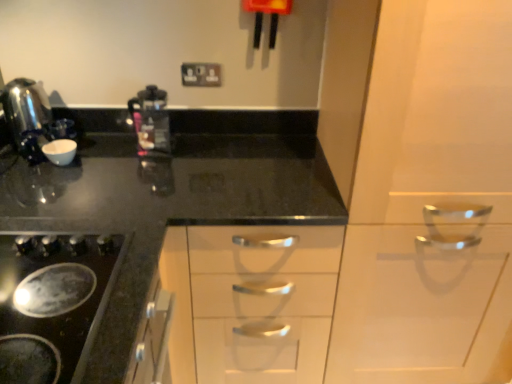
Question: Is polished stainless steel kettle at left far from black glass gas stove at lower left?

Choices:
 (A) yes
 (B) no

Answer: (B)

Question: Is polished stainless steel kettle at left further to the viewer compared to black glass gas stove at lower left?

Choices:
 (A) no
 (B) yes

Answer: (B)

Question: Is polished stainless steel kettle at left outside black glass gas stove at lower left?

Choices:
 (A) yes
 (B) no

Answer: (A)

Question: Is polished stainless steel kettle at left taller than black glass gas stove at lower left?

Choices:
 (A) no
 (B) yes

Answer: (B)

Question: Can you confirm if polished stainless steel kettle at left is bigger than black glass gas stove at lower left?

Choices:
 (A) yes
 (B) no

Answer: (A)

Question: Considering the positions of black plastic electric outlet at upper center and white glossy cabinet at center in the image, is black plastic electric outlet at upper center wider or thinner than white glossy cabinet at center?

Choices:
 (A) wide
 (B) thin

Answer: (B)

Question: From the image's perspective, is black plastic electric outlet at upper center positioned above or below white glossy cabinet at center?

Choices:
 (A) above
 (B) below

Answer: (A)

Question: Is point (182, 82) closer or farther from the camera than point (480, 97)?

Choices:
 (A) farther
 (B) closer

Answer: (A)

Question: From a real-world perspective, is black plastic electric outlet at upper center physically located above or below white glossy cabinet at center?

Choices:
 (A) above
 (B) below

Answer: (A)

Question: Is polished stainless steel kettle at left in front of or behind white glossy cabinet at center in the image?

Choices:
 (A) front
 (B) behind

Answer: (B)

Question: Based on their sizes in the image, would you say polished stainless steel kettle at left is bigger or smaller than white glossy cabinet at center?

Choices:
 (A) big
 (B) small

Answer: (B)

Question: Visually, is polished stainless steel kettle at left positioned to the left or to the right of white glossy cabinet at center?

Choices:
 (A) right
 (B) left

Answer: (B)

Question: From the image's perspective, is polished stainless steel kettle at left positioned above or below white glossy cabinet at center?

Choices:
 (A) above
 (B) below

Answer: (A)

Question: Is white glossy cabinet at center spatially inside black glass gas stove at lower left, or outside of it?

Choices:
 (A) outside
 (B) inside

Answer: (A)

Question: Looking at their shapes, would you say white glossy cabinet at center is wider or thinner than black glass gas stove at lower left?

Choices:
 (A) thin
 (B) wide

Answer: (B)